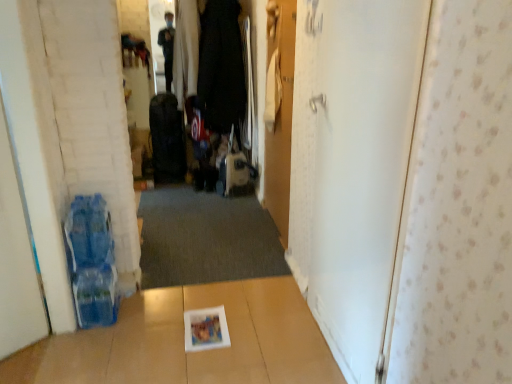
The image size is (512, 384). In order to click on blank space situated above dark gray carpet at center (from a real-world perspective) in this screenshot , I will do `click(209, 216)`.